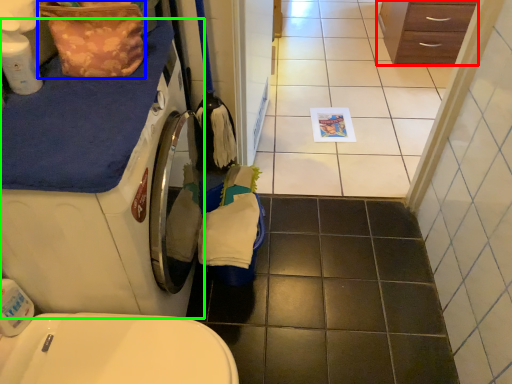
Question: Which object is the closest to the chest of drawers (highlighted by a red box)? Choose among these: material (highlighted by a blue box) or washing machine (highlighted by a green box).

Choices:
 (A) material
 (B) washing machine

Answer: (A)